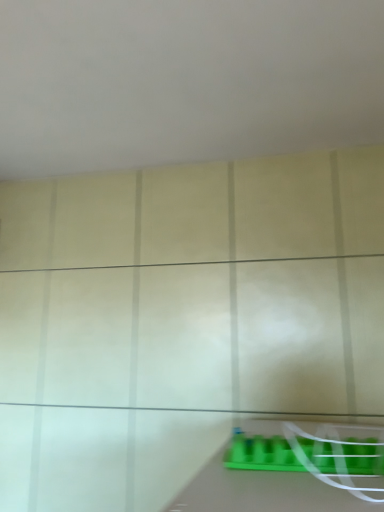
What is the approximate height of green plastic tray at lower right?

0.82 inches.

What do you see at coordinates (345, 455) in the screenshot?
I see `green plastic tray at lower right` at bounding box center [345, 455].

This screenshot has height=512, width=384. Find the location of `green plastic tray at lower right`. green plastic tray at lower right is located at coordinates (345, 455).

At what (x,y) coordinates should I click in order to perform the action: click on green plastic tray at lower right. Please return your answer as a coordinate pair (x, y). Looking at the image, I should click on (345, 455).